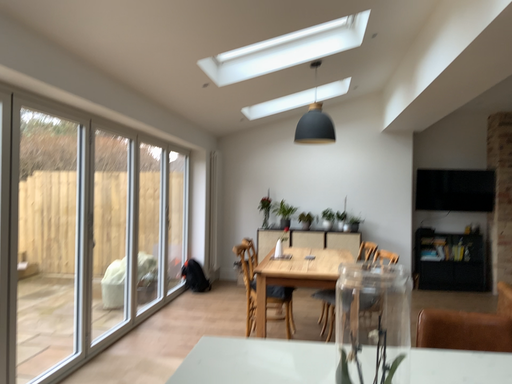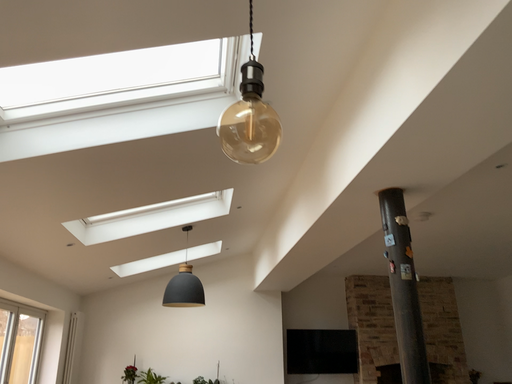
Question: Which way did the camera rotate in the video?

Choices:
 (A) rotated upward
 (B) rotated downward

Answer: (A)